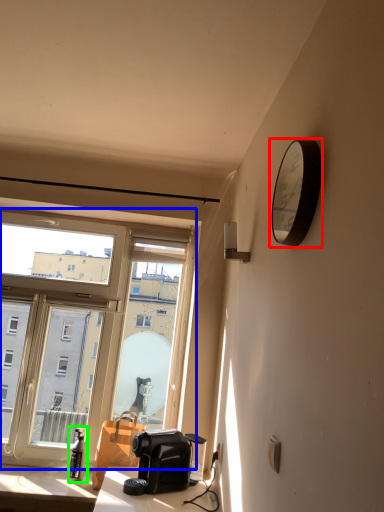
Question: Which is farther away from clock (highlighted by a red box)? window (highlighted by a blue box) or bottle (highlighted by a green box)?

Choices:
 (A) window
 (B) bottle

Answer: (B)